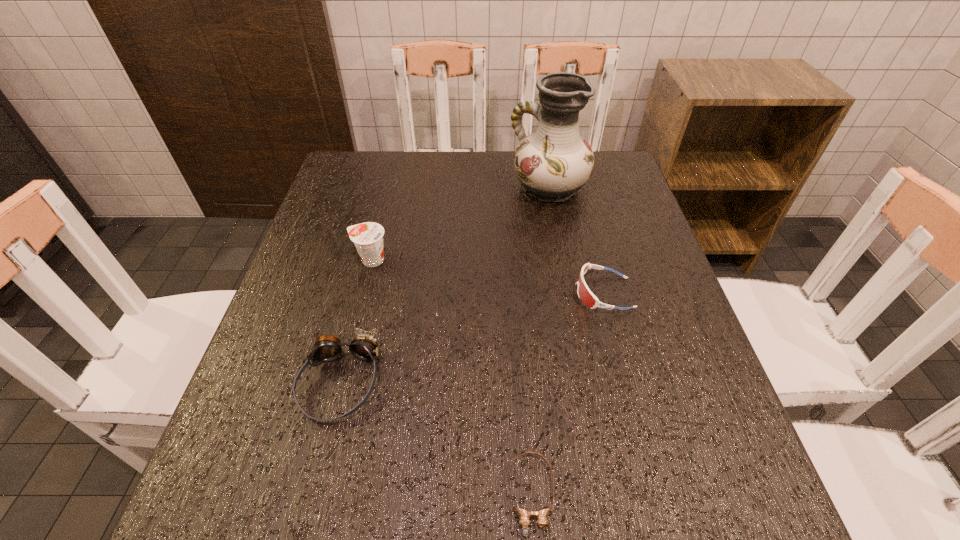
Identify the location of the farthest object. (553, 163).

The width and height of the screenshot is (960, 540). Find the location of `vase`. vase is located at coordinates [x=553, y=163].

Find the location of a particular element. This screenshot has height=540, width=960. the fourth nearest object is located at coordinates (368, 237).

Where is `yogurt`? yogurt is located at coordinates (368, 237).

Find the location of a particular element. This screenshot has height=540, width=960. the leftmost goggles is located at coordinates (327, 348).

I want to click on the tallest goggles, so click(x=327, y=348).

Find the location of a particular element. This screenshot has width=960, height=540. the third farthest object is located at coordinates (586, 296).

This screenshot has height=540, width=960. I want to click on the second shortest object, so click(586, 296).

Where is `the shortest goggles`? The height and width of the screenshot is (540, 960). the shortest goggles is located at coordinates (524, 516).

Find the location of `the shortest object`. the shortest object is located at coordinates (524, 516).